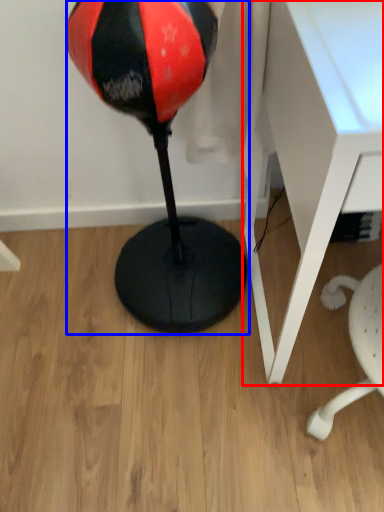
Question: Which object appears farthest to the camera in this image, table (highlighted by a red box) or bean bag chair (highlighted by a blue box)?

Choices:
 (A) table
 (B) bean bag chair

Answer: (B)